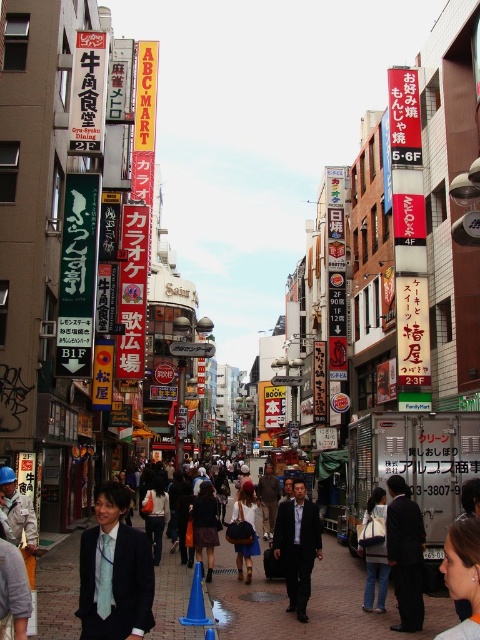
In the scene shown: You are standing on the brick pavement at center. A friend is standing at point 0.944, 0.648. Are you standing in the same location as your friend?

Yes, the brick pavement at center is located at point (311, 604), so you and your friend are standing in the same location.

You are standing on the bustling urban street scene in Japan. You see a person with blonde hair at center and a camera. Which object is closer to you?

The blonde hair at center is closer to you since it is 32.00 meters away from the camera, which is further away.